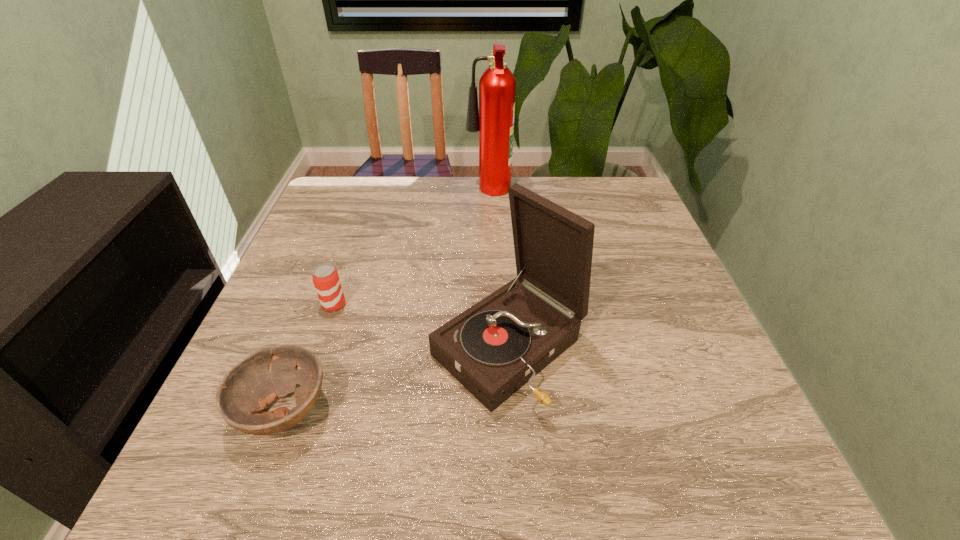
At what (x,y) coordinates should I click in order to perform the action: click on vacant region located on the back of the shortest object. Please return your answer as a coordinate pair (x, y). Looking at the image, I should click on point(346,242).

I want to click on object that is at the far edge, so [x=494, y=119].

The height and width of the screenshot is (540, 960). I want to click on object present at the near edge, so click(253, 384).

Identify the location of beer can that is at the left edge. (326, 280).

Identify the location of bowl located in the left edge section of the desktop. The image size is (960, 540). (253, 384).

Identify the location of object positioned at the near left corner. The width and height of the screenshot is (960, 540). (253, 384).

Identify the location of vacant space at the far edge of the desktop. This screenshot has height=540, width=960. click(376, 220).

In the image, there is a desktop. At what (x,y) coordinates should I click in order to perform the action: click on free region at the near edge. Please return your answer as a coordinate pair (x, y). The width and height of the screenshot is (960, 540). Looking at the image, I should click on (484, 479).

Locate an element on the screen. The height and width of the screenshot is (540, 960). vacant area at the left edge of the desktop is located at coordinates (309, 335).

Identify the location of free region at the right edge. (670, 362).